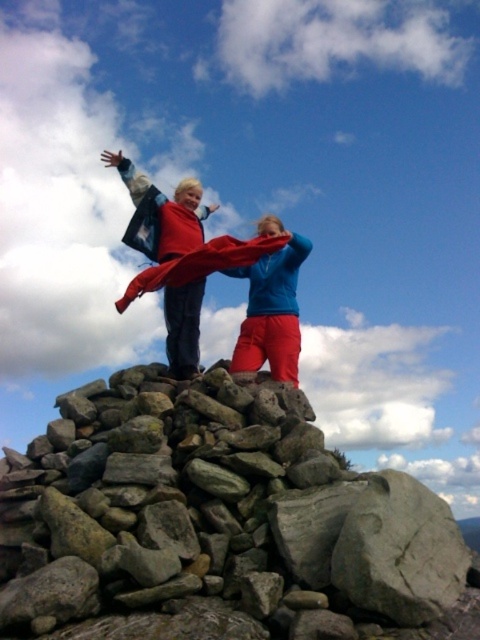
You are a photographer wanting to capture both the gray rock pile at center and the matte red scarf at center in the same frame. Based on their positions, which object should you focus on first to ensure both are in focus?

The gray rock pile at center is in front of the matte red scarf at center, so you should focus on the gray rock pile at center first to ensure both are in focus.

You are a photographer trying to capture the perfect shot of the matte red scarf at center. Based on the scene description, where should you position your camera to ensure the scarf is centered in the frame?

To center the matte red scarf at center in the frame, position your camera at the point corresponding to the coordinates provided in the scene description, which is at 2D location point (180, 257).

You are a photographer trying to capture a photo of the matte red scarf at center and the matte blue jacket at center. Which object should you focus on first if you want to ensure both are in sharp focus?

The matte red scarf at center is in front of the matte blue jacket at center, so you should focus on the matte red scarf at center first to ensure both are in sharp focus.